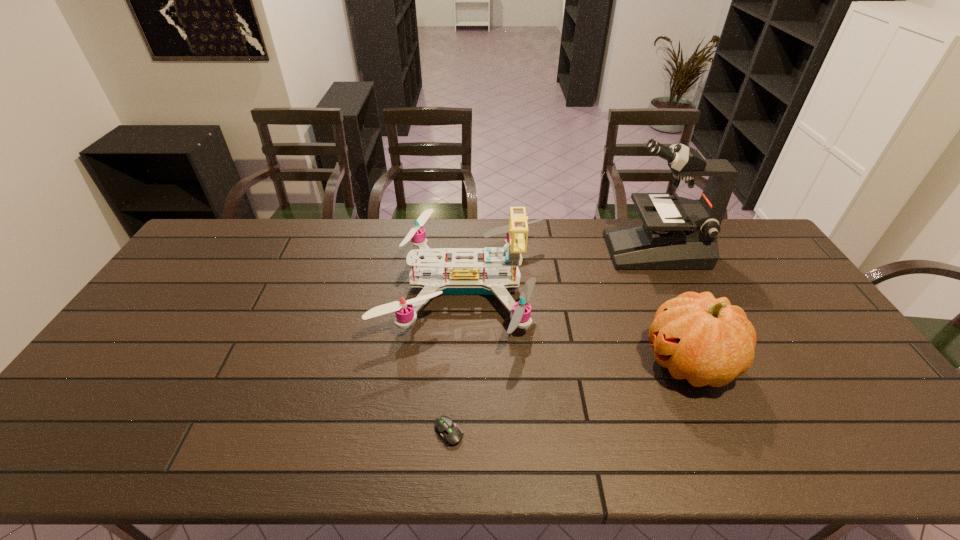
Find the location of a particular element. vacant space at the near left corner is located at coordinates (90, 464).

This screenshot has height=540, width=960. I want to click on free space that is in between the pumpkin and the drone, so click(577, 325).

Identify the location of empty space between the nearest object and the tallest object. The image size is (960, 540). (552, 341).

Image resolution: width=960 pixels, height=540 pixels. Identify the location of free space that is in between the pumpkin and the computer mouse. (568, 397).

In order to click on unoccupied position between the microscope and the drone in this screenshot , I will do `click(560, 269)`.

You are a GUI agent. You are given a task and a screenshot of the screen. Output one action in this format:
    pyautogui.click(x=<x>, y=<y>)
    Task: Click on the vacant space that is in between the nearest object and the drone
    The width and height of the screenshot is (960, 540).
    Given the screenshot: What is the action you would take?
    pyautogui.click(x=457, y=360)

This screenshot has height=540, width=960. I want to click on vacant region between the nearest object and the drone, so click(457, 360).

Locate an element on the screen. The width and height of the screenshot is (960, 540). free point between the drone and the tallest object is located at coordinates (560, 269).

I want to click on the third closest object relative to the nearest object, so click(x=682, y=234).

Where is `object that ranks as the closest to the microscope`? object that ranks as the closest to the microscope is located at coordinates (464, 276).